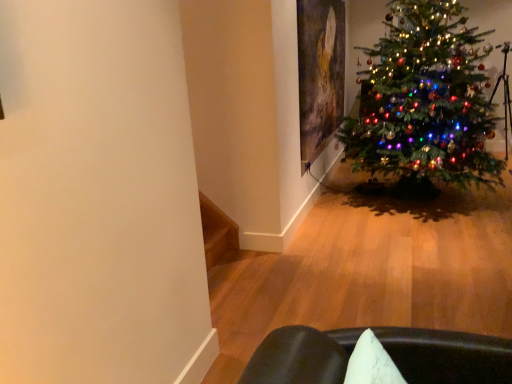
Where is `oil painting at upper right`? Image resolution: width=512 pixels, height=384 pixels. oil painting at upper right is located at coordinates (320, 73).

What do you see at coordinates (320, 73) in the screenshot? I see `oil painting at upper right` at bounding box center [320, 73].

In order to click on multicolored lights christmas tree at right in this screenshot , I will do `click(424, 100)`.

What do you see at coordinates (424, 100) in the screenshot? This screenshot has width=512, height=384. I see `multicolored lights christmas tree at right` at bounding box center [424, 100].

Identify the location of oil painting at upper right. [x=320, y=73].

Which object is positioned more to the left, multicolored lights christmas tree at right or oil painting at upper right?

oil painting at upper right is more to the left.

In the image, is multicolored lights christmas tree at right positioned in front of or behind oil painting at upper right?

multicolored lights christmas tree at right is positioned closer to the viewer than oil painting at upper right.

Between point (398, 163) and point (328, 19), which one is positioned in front?

The point (398, 163) is more forward.

From the image's perspective, is multicolored lights christmas tree at right above oil painting at upper right?

No, from the image's perspective, multicolored lights christmas tree at right is not on top of oil painting at upper right.

From a real-world perspective, is multicolored lights christmas tree at right beneath oil painting at upper right?

Yes, from a real-world perspective, multicolored lights christmas tree at right is beneath oil painting at upper right.

Between multicolored lights christmas tree at right and oil painting at upper right, which one has larger width?

multicolored lights christmas tree at right is wider.

Considering the relative sizes of multicolored lights christmas tree at right and oil painting at upper right in the image provided, is multicolored lights christmas tree at right shorter than oil painting at upper right?

In fact, multicolored lights christmas tree at right may be taller than oil painting at upper right.

Which of these two, multicolored lights christmas tree at right or oil painting at upper right, is smaller?

oil painting at upper right.

Do you think multicolored lights christmas tree at right is within oil painting at upper right, or outside of it?

multicolored lights christmas tree at right cannot be found inside oil painting at upper right.

Are multicolored lights christmas tree at right and oil painting at upper right located far from each other?

multicolored lights christmas tree at right is actually quite close to oil painting at upper right.

Could you tell me if multicolored lights christmas tree at right is turned towards oil painting at upper right?

Yes, multicolored lights christmas tree at right faces towards oil painting at upper right.

Find the location of a particular element. This screenshot has width=512, height=384. picture frame behind the multicolored lights christmas tree at right is located at coordinates (320, 73).

Visually, is oil painting at upper right positioned to the left or to the right of multicolored lights christmas tree at right?

oil painting at upper right is positioned on multicolored lights christmas tree at right's left side.

Who is more distant, oil painting at upper right or multicolored lights christmas tree at right?

oil painting at upper right is more distant.

Is point (300, 65) farther from viewer compared to point (355, 132)?

No, (300, 65) is in front of (355, 132).

From the image's perspective, who appears lower, oil painting at upper right or multicolored lights christmas tree at right?

multicolored lights christmas tree at right is shown below in the image.

From a real-world perspective, is oil painting at upper right physically below multicolored lights christmas tree at right?

No, from a real-world perspective, oil painting at upper right is not beneath multicolored lights christmas tree at right.

Considering the relative sizes of oil painting at upper right and multicolored lights christmas tree at right in the image provided, is oil painting at upper right thinner than multicolored lights christmas tree at right?

Indeed, oil painting at upper right has a lesser width compared to multicolored lights christmas tree at right.

Between oil painting at upper right and multicolored lights christmas tree at right, which one has less height?

Standing shorter between the two is oil painting at upper right.

Considering the relative sizes of oil painting at upper right and multicolored lights christmas tree at right in the image provided, is oil painting at upper right bigger than multicolored lights christmas tree at right?

Incorrect, oil painting at upper right is not larger than multicolored lights christmas tree at right.

Is oil painting at upper right outside of multicolored lights christmas tree at right?

Yes, oil painting at upper right is located beyond the bounds of multicolored lights christmas tree at right.

Are oil painting at upper right and multicolored lights christmas tree at right making contact?

No, oil painting at upper right is not with multicolored lights christmas tree at right.

Is oil painting at upper right positioned with its back to multicolored lights christmas tree at right?

That's right, oil painting at upper right is facing away from multicolored lights christmas tree at right.

How far apart are oil painting at upper right and multicolored lights christmas tree at right?

30.85 inches.

In order to click on christmas tree on the right of oil painting at upper right in this screenshot , I will do `click(424, 100)`.

I want to click on picture frame lying behind the multicolored lights christmas tree at right, so click(x=320, y=73).

This screenshot has height=384, width=512. I want to click on christmas tree located in front of the oil painting at upper right, so click(x=424, y=100).